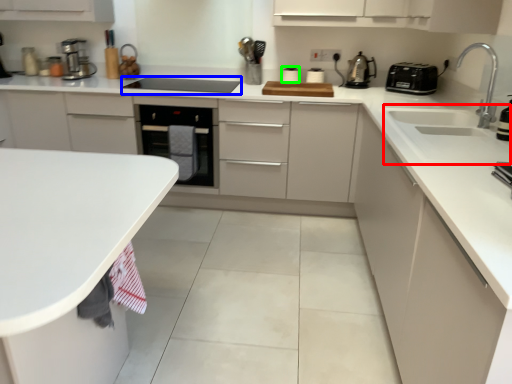
Question: Which is farther away from sink (highlighted by a red box)? appliance (highlighted by a blue box) or appliance (highlighted by a green box)?

Choices:
 (A) appliance
 (B) appliance

Answer: (A)